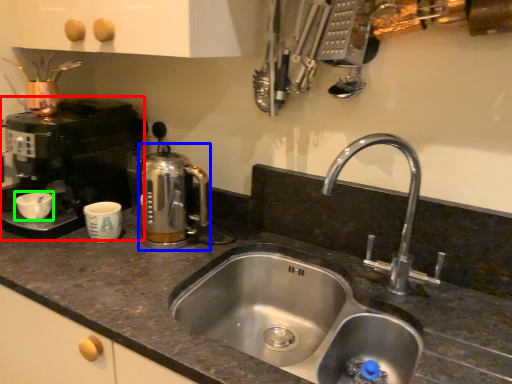
Question: Considering the real-world distances, which object is closest to coffee machine (highlighted by a red box)? coffeepot (highlighted by a blue box) or basin (highlighted by a green box).

Choices:
 (A) coffeepot
 (B) basin

Answer: (B)